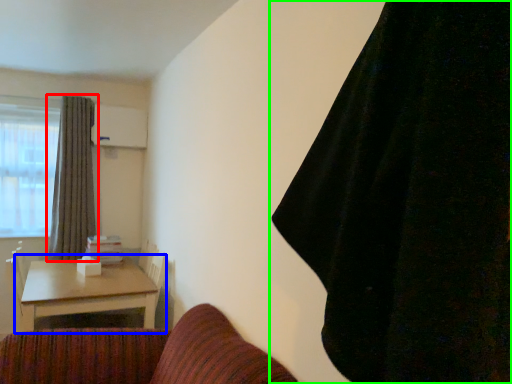
Question: Estimate the real-world distances between objects in this image. Which object is closer to curtain (highlighted by a red box), table (highlighted by a blue box) or curtain (highlighted by a green box)?

Choices:
 (A) table
 (B) curtain

Answer: (A)